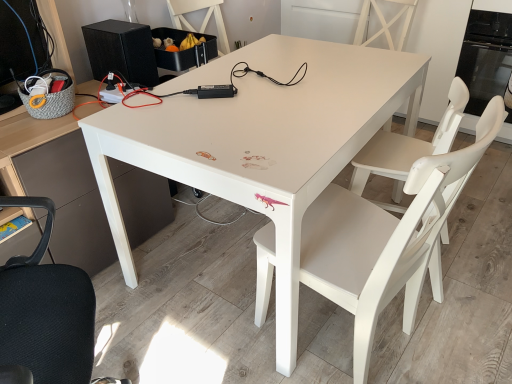
Question: From their relative heights in the image, would you say black matte speaker at upper left is taller or shorter than black glass oven at upper right?

Choices:
 (A) short
 (B) tall

Answer: (A)

Question: From a real-world perspective, is black matte speaker at upper left above or below black glass oven at upper right?

Choices:
 (A) below
 (B) above

Answer: (B)

Question: Which object is the farthest from the black matte speaker at upper left?

Choices:
 (A) white matte table at center
 (B) black glass oven at upper right
 (C) matte black desk at left
 (D) white matte chair at center
 (E) white matte chair at center

Answer: (B)

Question: Estimate the real-world distances between objects in this image. Which object is farther from the white matte table at center?

Choices:
 (A) matte black desk at left
 (B) black glass oven at upper right
 (C) white matte chair at center
 (D) white matte chair at center
 (E) black matte speaker at upper left

Answer: (B)